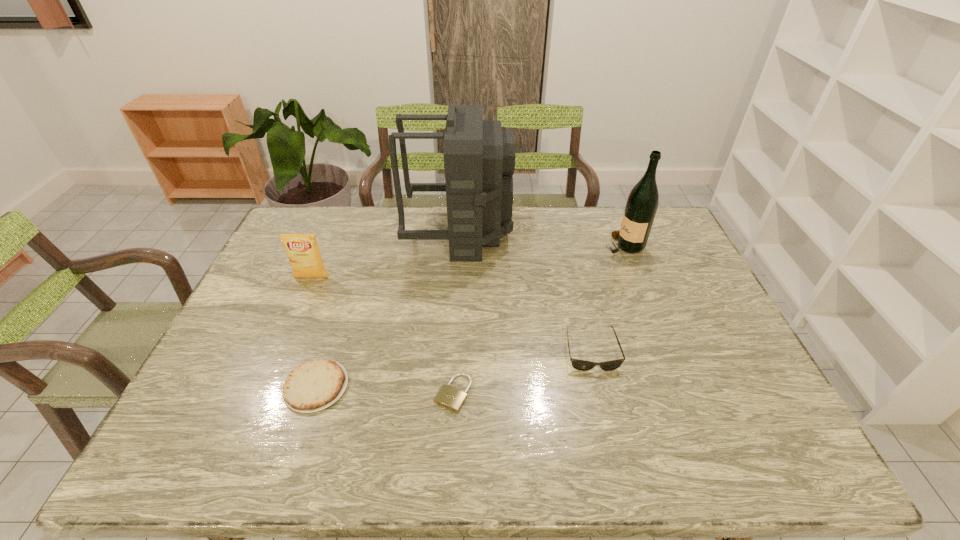
Locate an element on the screen. The image size is (960, 540). vacant space at the far edge is located at coordinates (554, 227).

You are a GUI agent. You are given a task and a screenshot of the screen. Output one action in this format:
    pyautogui.click(x=<x>, y=<y>)
    Task: Click on the free space at the near edge of the desktop
    The height and width of the screenshot is (540, 960).
    Given the screenshot: What is the action you would take?
    pyautogui.click(x=266, y=445)

Locate an element on the screen. vacant space at the left edge of the desktop is located at coordinates (218, 352).

This screenshot has width=960, height=540. What are the coordinates of `free space at the right edge of the desktop` in the screenshot? It's located at (678, 330).

The image size is (960, 540). What are the coordinates of `free space between the tallest object and the tortilla` in the screenshot? It's located at (388, 310).

I want to click on unoccupied position between the fourth nearest object and the third shortest object, so click(451, 314).

The width and height of the screenshot is (960, 540). In order to click on empty space between the tallest object and the third farthest object in this screenshot , I will do `click(385, 255)`.

What are the coordinates of `empty space between the tallest object and the fifth tallest object` in the screenshot? It's located at (388, 310).

The image size is (960, 540). What are the coordinates of `free spot between the fourth shortest object and the second shortest object` in the screenshot? It's located at [314, 332].

Locate an element on the screen. vacant space in between the tortilla and the third farthest object is located at coordinates (314, 332).